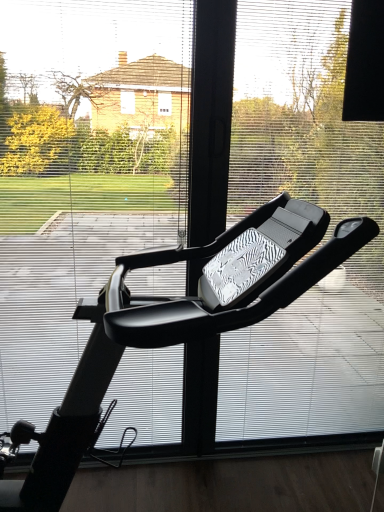
This screenshot has width=384, height=512. What do you see at coordinates (82, 170) in the screenshot? I see `transparent glass window at center` at bounding box center [82, 170].

I want to click on transparent glass window at center, so click(82, 170).

Where is `transparent glass window at center`? The image size is (384, 512). transparent glass window at center is located at coordinates (82, 170).